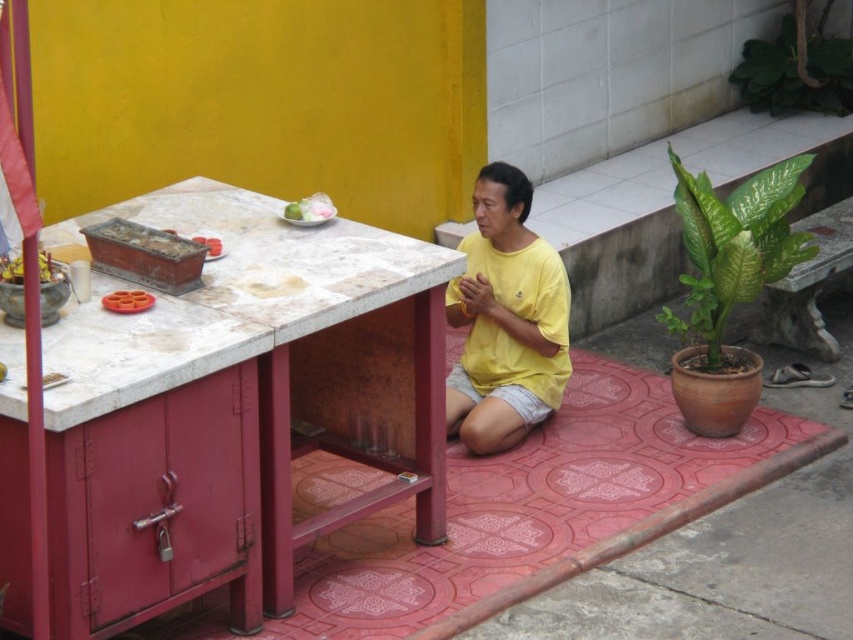
Question: Is green glossy leafy plant at right bigger than green matte fruit at upper center?

Choices:
 (A) yes
 (B) no

Answer: (A)

Question: Is green glossy leafy plant at right smaller than white glossy plate at center?

Choices:
 (A) no
 (B) yes

Answer: (A)

Question: Estimate the real-world distances between objects in this image. Which object is farther from the white glossy plate at center?

Choices:
 (A) green leafy plant at upper right
 (B) yellow matte shirt at center
 (C) green matte fruit at upper center
 (D) green glossy leafy plant at right

Answer: (A)

Question: Which of the following is the closest to the observer?

Choices:
 (A) (497, 305)
 (B) (183, 300)
 (C) (283, 209)
 (D) (202, 237)

Answer: (B)

Question: Does yellow matte shirt at center have a lesser width compared to white glossy plate at center?

Choices:
 (A) yes
 (B) no

Answer: (B)

Question: Which point appears closest to the camera in this image?

Choices:
 (A) (798, 90)
 (B) (318, 200)
 (C) (682, 164)
 (D) (206, 237)

Answer: (D)